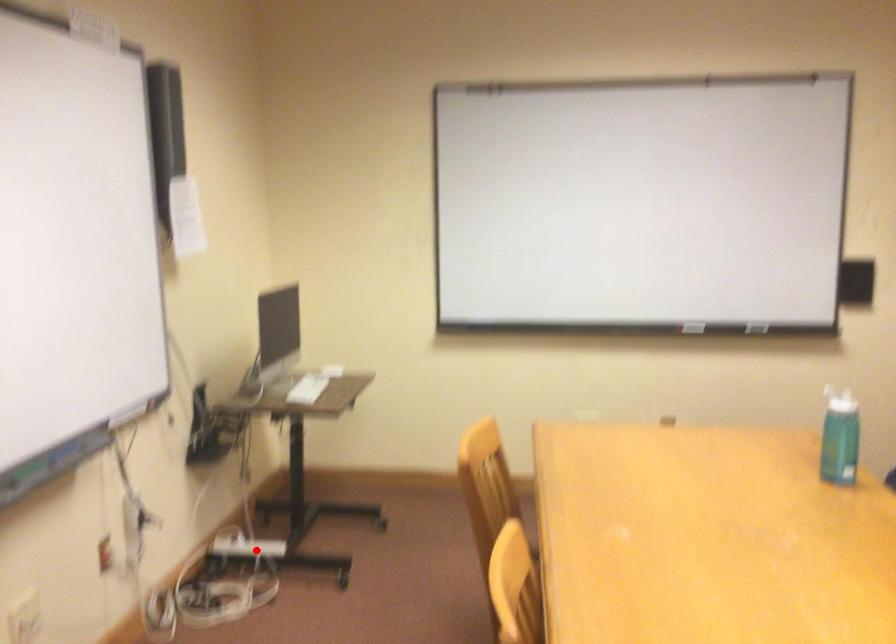
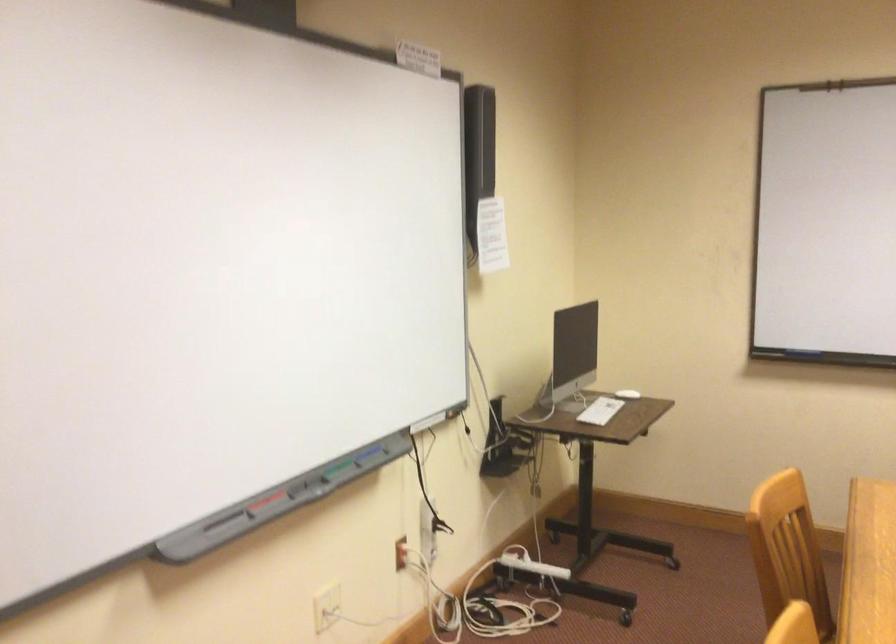
Locate, in the second image, the point that corresponds to the highlighted location in the first image.

(530, 564)